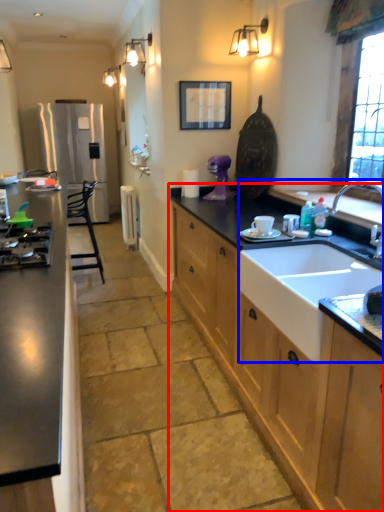
Question: Which object is closer to the camera taking this photo, cabinetry (highlighted by a red box) or sink (highlighted by a blue box)?

Choices:
 (A) cabinetry
 (B) sink

Answer: (A)